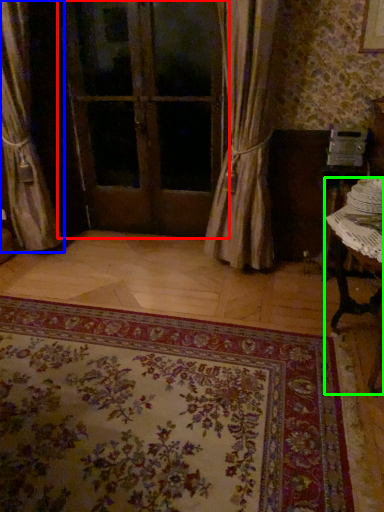
Question: Which object is positioned closest to door (highlighted by a red box)? Select from curtain (highlighted by a blue box) and table (highlighted by a green box).

Choices:
 (A) curtain
 (B) table

Answer: (A)